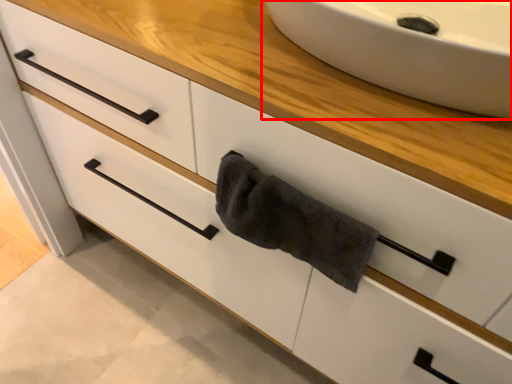
Question: Considering the relative positions of sink (annotated by the red box) and bath towel in the image provided, where is sink (annotated by the red box) located with respect to the staircase?

Choices:
 (A) left
 (B) right

Answer: (B)